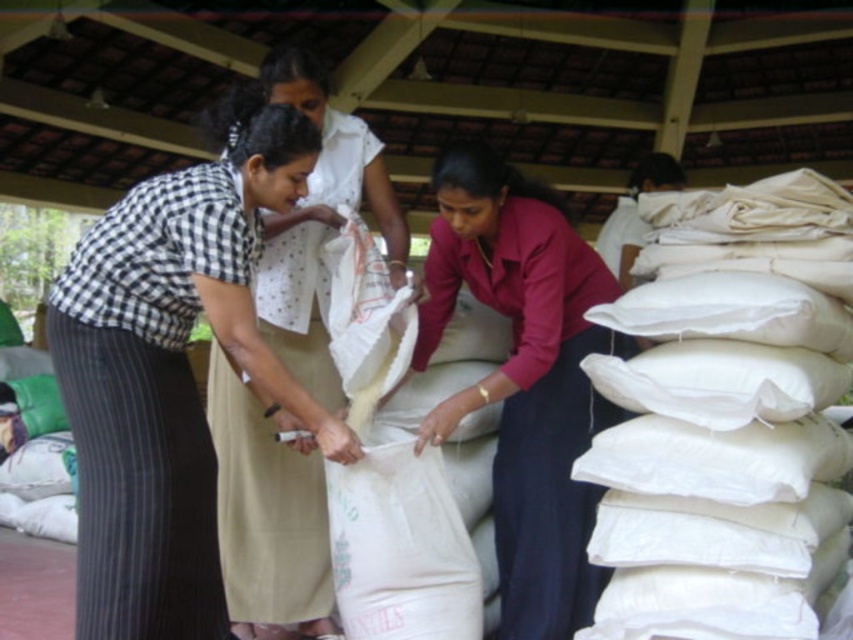
Question: Observing the image, what is the correct spatial positioning of black checkered shirt at left in reference to checkered fabric shirt at center?

Choices:
 (A) below
 (B) above

Answer: (A)

Question: Which object is positioned farthest from the white matte sack at center?

Choices:
 (A) matte pink shirt at center
 (B) black checkered shirt at left
 (C) checkered fabric shirt at center

Answer: (C)

Question: Is matte pink shirt at center smaller than white matte sack at center?

Choices:
 (A) no
 (B) yes

Answer: (A)

Question: Which point is farther from the camera taking this photo?

Choices:
 (A) (541, 442)
 (B) (438, 486)
 (C) (178, 394)

Answer: (A)

Question: From the image, what is the correct spatial relationship of black checkered shirt at left in relation to checkered fabric shirt at center?

Choices:
 (A) below
 (B) above

Answer: (A)

Question: Which is farther from the white matte sack at center?

Choices:
 (A) black checkered shirt at left
 (B) checkered fabric shirt at center

Answer: (B)